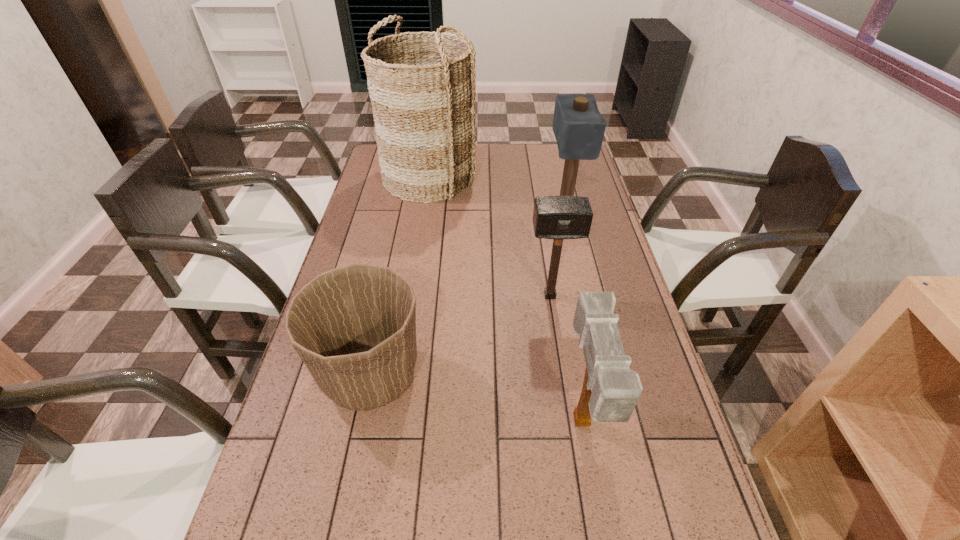
In order to click on free location located on the back of the shortest object in this screenshot , I will do `click(388, 296)`.

In order to click on object that is at the far edge in this screenshot , I will do `click(422, 86)`.

This screenshot has width=960, height=540. Find the location of `basket present at the left edge`. basket present at the left edge is located at coordinates (422, 86).

Image resolution: width=960 pixels, height=540 pixels. I want to click on flowerpot that is at the left edge, so click(x=354, y=327).

Where is `object present at the right edge`? object present at the right edge is located at coordinates (578, 126).

The height and width of the screenshot is (540, 960). In order to click on object at the far left corner in this screenshot , I will do `click(422, 86)`.

Locate an element on the screen. The image size is (960, 540). free space at the far edge is located at coordinates (516, 172).

This screenshot has width=960, height=540. In the image, there is a desktop. What are the coordinates of `vacant space at the left edge` in the screenshot? It's located at (392, 241).

This screenshot has height=540, width=960. I want to click on free region at the right edge of the desktop, so click(x=657, y=400).

In the image, there is a desktop. Where is `vacant space at the far right corner`? vacant space at the far right corner is located at coordinates (553, 170).